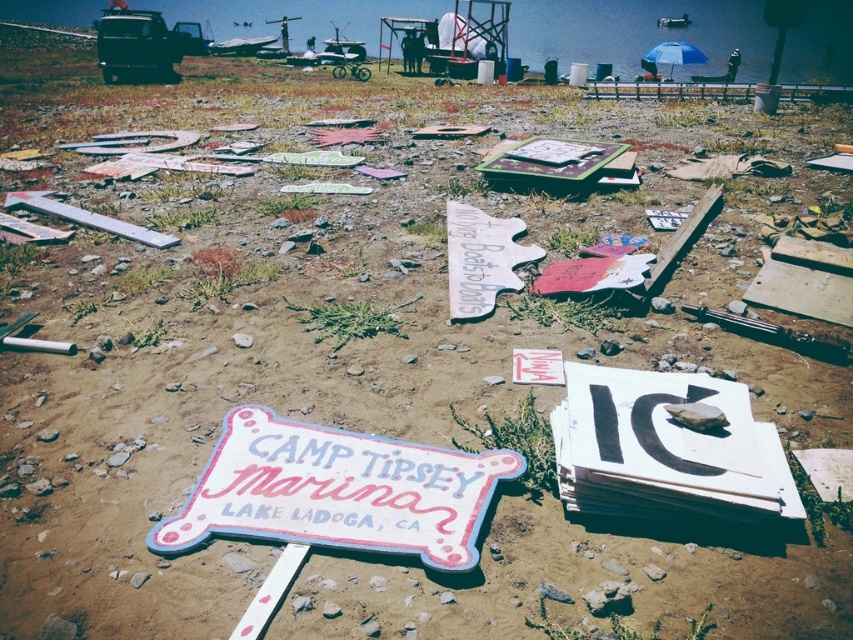
Question: Is pastel painted wooden sign at center to the right of white painted wood sign at center from the viewer's perspective?

Choices:
 (A) no
 (B) yes

Answer: (A)

Question: Does pastel painted wooden sign at center appear on the right side of white painted wood sign at center?

Choices:
 (A) no
 (B) yes

Answer: (A)

Question: Among these objects, which one is farthest from the camera?

Choices:
 (A) blue fabric umbrella at upper right
 (B) white painted wood sign at center
 (C) pastel painted wooden sign at center

Answer: (A)

Question: Which is nearer to the white painted wood sign at center?

Choices:
 (A) blue fabric umbrella at upper right
 (B) pastel painted wooden sign at center

Answer: (B)

Question: Which point appears closest to the camera in this image?

Choices:
 (A) (363, 472)
 (B) (653, 56)
 (C) (492, 266)

Answer: (A)

Question: Is pastel painted wooden sign at center below blue fabric umbrella at upper right?

Choices:
 (A) yes
 (B) no

Answer: (A)